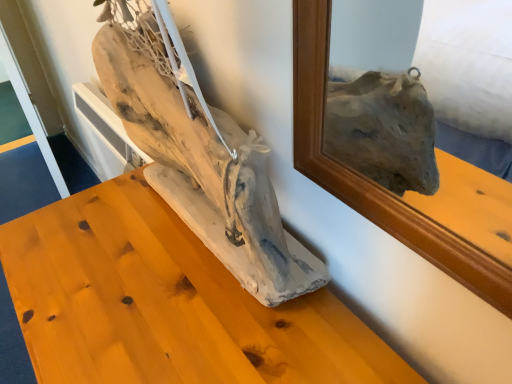
Identify the location of vacant region below natural wood driftwood at center (from a real-world perspective). (195, 242).